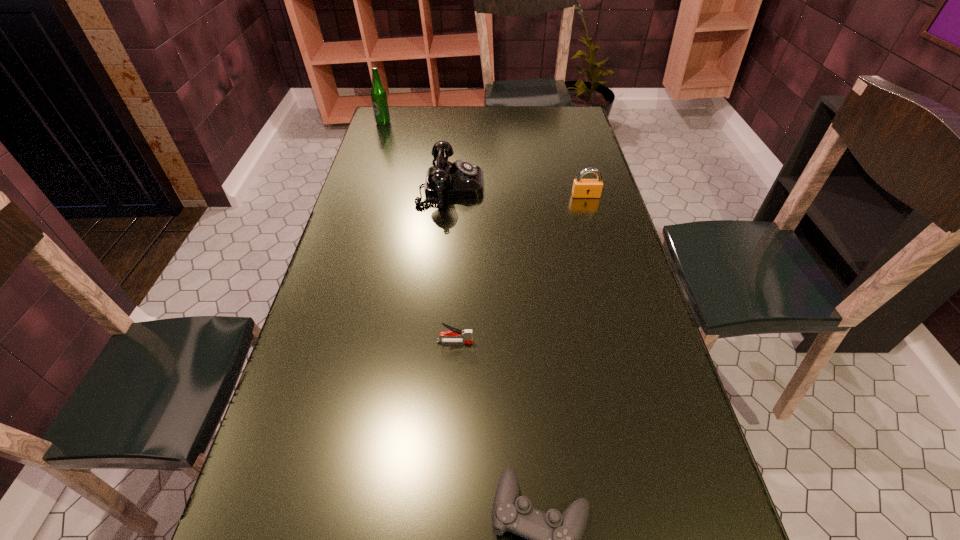
Where is `free spot located on the handle side of the fourth tallest object`? free spot located on the handle side of the fourth tallest object is located at coordinates (539, 342).

This screenshot has width=960, height=540. What are the coordinates of `object at the far edge` in the screenshot? It's located at (378, 94).

Find the location of a particular element. Image resolution: width=960 pixels, height=540 pixels. object present at the left edge is located at coordinates point(378,94).

Where is `object present at the right edge`? The image size is (960, 540). object present at the right edge is located at coordinates (582, 188).

Where is `object present at the far left corner`? This screenshot has height=540, width=960. object present at the far left corner is located at coordinates (378, 94).

Where is `vacant region at the far edge`? The height and width of the screenshot is (540, 960). vacant region at the far edge is located at coordinates click(x=502, y=125).

Image resolution: width=960 pixels, height=540 pixels. I want to click on free space at the left edge of the desktop, so click(x=277, y=441).

Where is `blank area at the right edge`? The image size is (960, 540). blank area at the right edge is located at coordinates (550, 143).

You are a GUI agent. You are given a task and a screenshot of the screen. Output one action in this format:
    pyautogui.click(x=<x>, y=<y>)
    Task: Click on the free space at the far right corner
    The height and width of the screenshot is (540, 960).
    Given the screenshot: What is the action you would take?
    pyautogui.click(x=549, y=119)

Locate an element on the screen. The height and width of the screenshot is (540, 960). free space between the third tallest object and the tallest object is located at coordinates (485, 159).